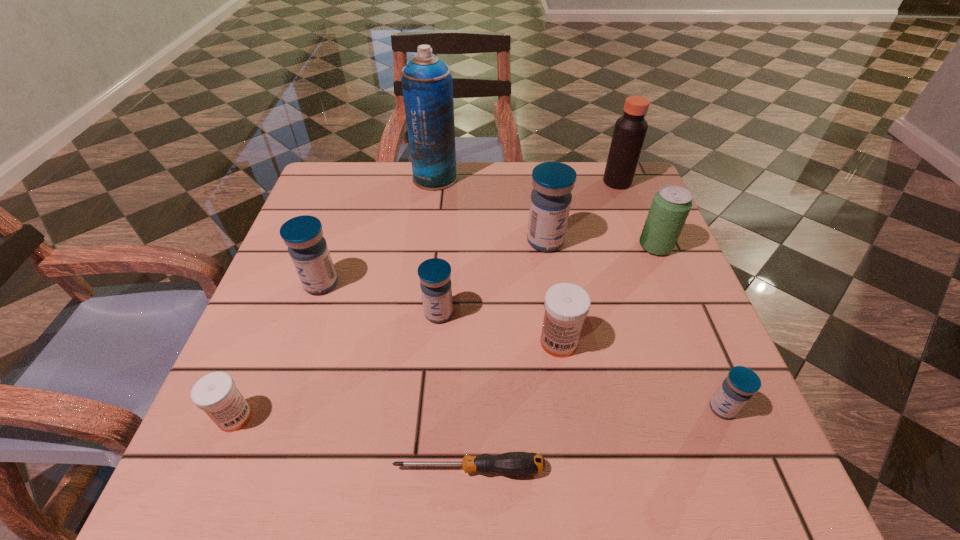
Find the location of `the tallest object`. the tallest object is located at coordinates (427, 84).

Locate an element on the screen. The image size is (960, 540). the second tallest object is located at coordinates (630, 129).

What are the coordinates of `brown vinegar` in the screenshot? It's located at (630, 129).

This screenshot has width=960, height=540. I want to click on the third blue medicine from left to right, so click(x=551, y=198).

Where is `the eighth shortest object`? The width and height of the screenshot is (960, 540). the eighth shortest object is located at coordinates (551, 198).

You are a GUI agent. You are given a task and a screenshot of the screen. Output one action in this format:
    pyautogui.click(x=<x>, y=<y>)
    Task: Click on the leftmost blue medicine
    
    Given the screenshot: What is the action you would take?
    pyautogui.click(x=303, y=235)

Find the location of a particular element. the second biggest blue medicine is located at coordinates (303, 235).

Where is `soda`? This screenshot has width=960, height=540. soda is located at coordinates (671, 205).

Find the location of `the second blue medicine from left to right`. the second blue medicine from left to right is located at coordinates (435, 273).

The height and width of the screenshot is (540, 960). I want to click on the third biggest blue medicine, so click(435, 273).